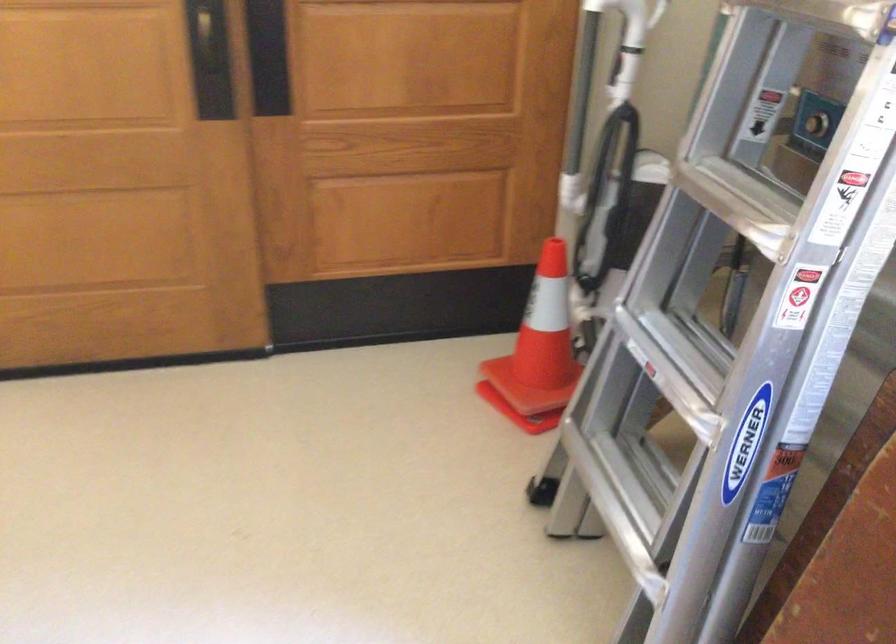
This screenshot has width=896, height=644. What are the coordinates of `orange traffic cone` in the screenshot? It's located at (539, 343).